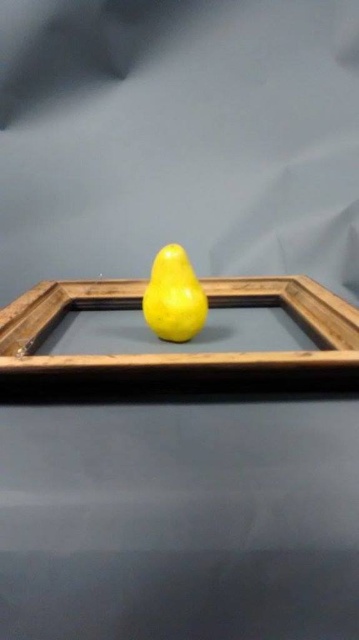
You are an art curator examining the image. You notice the wooden frame at center and the yellow matte pear at center. Which object is positioned closer to the viewer?

The wooden frame at center is closer to the viewer than the yellow matte pear at center.

You are an art curator arranging an exhibition. You have a wooden frame at center and a yellow matte pear at center. Which object is placed lower in the composition?

The wooden frame at center is positioned under the yellow matte pear at center, so the wooden frame at center is placed lower.